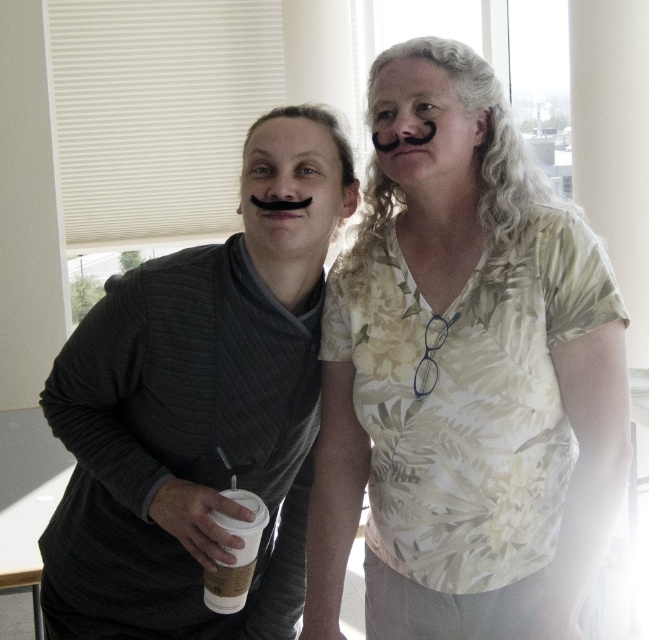
Question: Can you confirm if black matte mustache at center is bigger than black matte mustache at upper center?

Choices:
 (A) no
 (B) yes

Answer: (B)

Question: Which of the following is the closest to the observer?

Choices:
 (A) (286, 122)
 (B) (88, 586)
 (C) (260, 513)
 (D) (465, 310)

Answer: (D)

Question: Considering the real-world distances, which object is farthest from the black matte mustache at upper center?

Choices:
 (A) brown paper cup at lower left
 (B) dark gray sweater at center
 (C) floral print blouse at center

Answer: (A)

Question: Which is nearer to the brown paper cup at lower left?

Choices:
 (A) black matte mustache at upper center
 (B) floral print blouse at center
 (C) black matte mustache at center
 (D) dark gray sweater at center

Answer: (D)

Question: Does dark gray sweater at center have a lesser width compared to brown paper cup at lower left?

Choices:
 (A) yes
 (B) no

Answer: (B)

Question: In this image, where is dark gray sweater at center located relative to brown paper cup at lower left?

Choices:
 (A) below
 (B) above

Answer: (B)